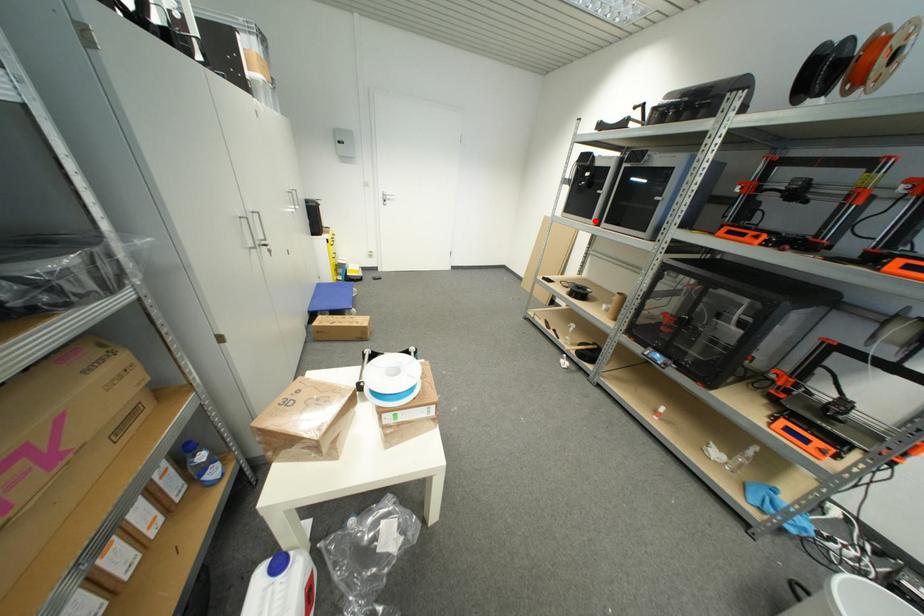
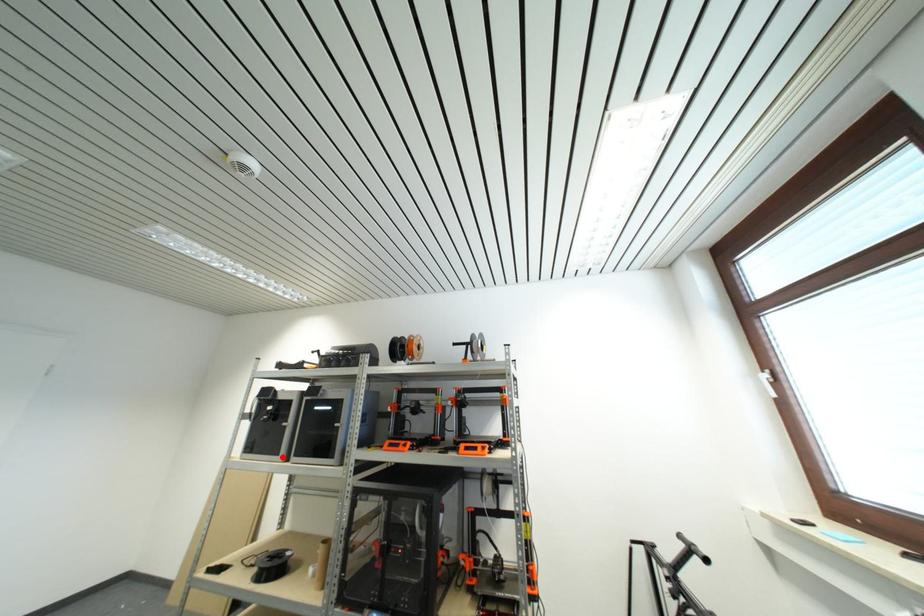
I am providing you with two images of the same scene from different viewpoints. A red point is marked on the first image and another point is marked on the second image. Do the highlighted points in image1 and image2 indicate the same real-world spot?

Yes